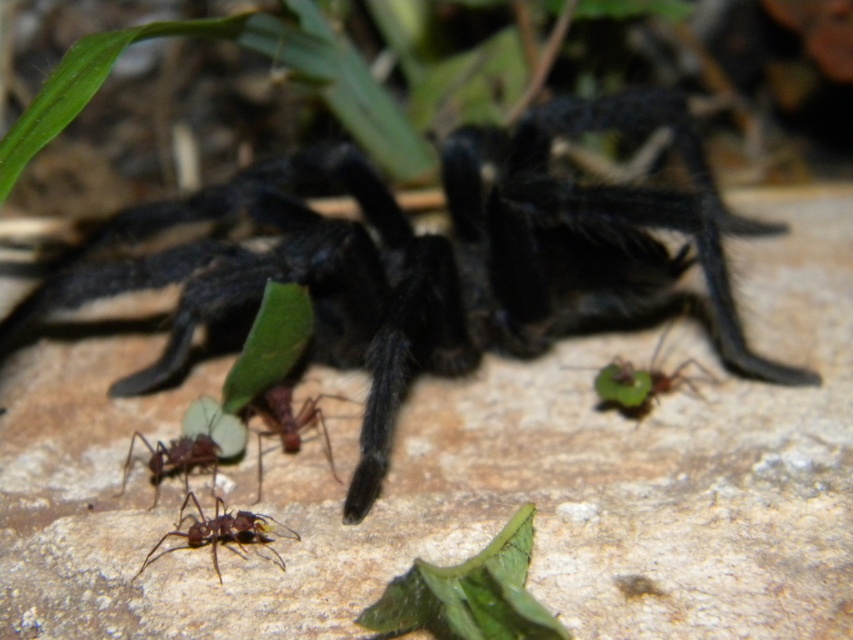
You are a biologist observing the ants in the image. You need to place a 3.5 inch wide magnifying glass between the brown matte ant at lower left and the brown matte ant at center. Will the magnifying glass fit without overlapping either ant?

The distance between the brown matte ant at lower left and the brown matte ant at center is 4.04 inches. Since the magnifying glass is 3.5 inches wide, it will fit between them without overlapping either ant as there is enough space.

You are a botanist studying plants in a forest. You see a green leafy plant at lower center. Can you determine its exact location in the image using coordinates?

The green leafy plant at lower center is located at coordinates point (469, 593).

You are a biologist observing the scene. You need to locate the black fuzzy spider at center. What are its coordinates?

The black fuzzy spider at center is located at coordinates point (432, 260).